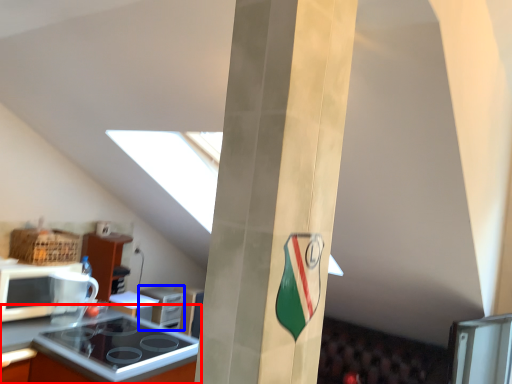
Question: Which of the following is the closest to the observer, countertop (highlighted by a red box) or appliance (highlighted by a blue box)?

Choices:
 (A) countertop
 (B) appliance

Answer: (A)